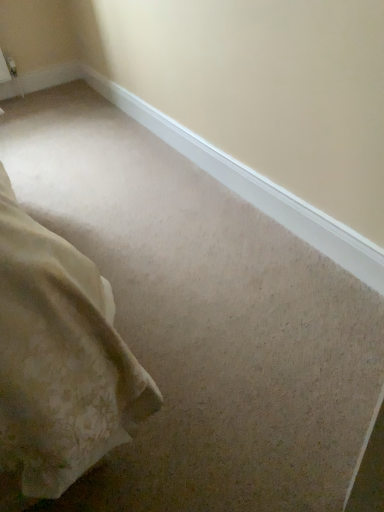
Locate an element on the screen. white smooth baseboard at upper right is located at coordinates (253, 186).

Looking at this image, what is the approximate height of white smooth baseboard at upper right?

The height of white smooth baseboard at upper right is 14.55 centimeters.

What do you see at coordinates (253, 186) in the screenshot? I see `white smooth baseboard at upper right` at bounding box center [253, 186].

Image resolution: width=384 pixels, height=512 pixels. Identify the location of white smooth baseboard at upper right. [x=253, y=186].